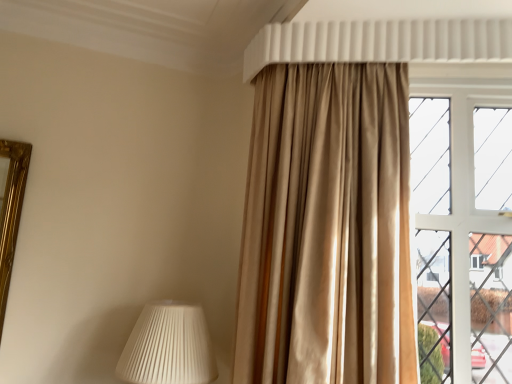
Question: From a real-world perspective, is white pleated lampshade at lower left positioned under white glass window at right based on gravity?

Choices:
 (A) no
 (B) yes

Answer: (B)

Question: Considering the relative sizes of white pleated lampshade at lower left and white glass window at right in the image provided, is white pleated lampshade at lower left taller than white glass window at right?

Choices:
 (A) yes
 (B) no

Answer: (B)

Question: From the image's perspective, is white pleated lampshade at lower left beneath white glass window at right?

Choices:
 (A) yes
 (B) no

Answer: (A)

Question: Considering the relative sizes of white pleated lampshade at lower left and white glass window at right in the image provided, is white pleated lampshade at lower left bigger than white glass window at right?

Choices:
 (A) no
 (B) yes

Answer: (A)

Question: Is white pleated lampshade at lower left to the right of white glass window at right from the viewer's perspective?

Choices:
 (A) no
 (B) yes

Answer: (A)

Question: From the image's perspective, is white pleated lampshade at lower left above or below satin beige curtain at upper right?

Choices:
 (A) above
 (B) below

Answer: (B)

Question: Considering the positions of white pleated lampshade at lower left and satin beige curtain at upper right in the image, is white pleated lampshade at lower left wider or thinner than satin beige curtain at upper right?

Choices:
 (A) thin
 (B) wide

Answer: (B)

Question: From a real-world perspective, is white pleated lampshade at lower left positioned above or below satin beige curtain at upper right?

Choices:
 (A) above
 (B) below

Answer: (B)

Question: Is point (135, 324) closer or farther from the camera than point (400, 374)?

Choices:
 (A) farther
 (B) closer

Answer: (A)

Question: From a real-world perspective, is white plastic shutter at upper center above or below white pleated lampshade at lower left?

Choices:
 (A) above
 (B) below

Answer: (A)

Question: Which is correct: white plastic shutter at upper center is inside white pleated lampshade at lower left, or outside of it?

Choices:
 (A) outside
 (B) inside

Answer: (A)

Question: Does point (329, 54) appear closer or farther from the camera than point (125, 375)?

Choices:
 (A) closer
 (B) farther

Answer: (B)

Question: Is white plastic shutter at upper center taller or shorter than white pleated lampshade at lower left?

Choices:
 (A) short
 (B) tall

Answer: (A)

Question: Considering the positions of satin beige curtain at upper right and white plastic shutter at upper center in the image, is satin beige curtain at upper right bigger or smaller than white plastic shutter at upper center?

Choices:
 (A) small
 (B) big

Answer: (B)

Question: Which is correct: satin beige curtain at upper right is inside white plastic shutter at upper center, or outside of it?

Choices:
 (A) inside
 (B) outside

Answer: (B)